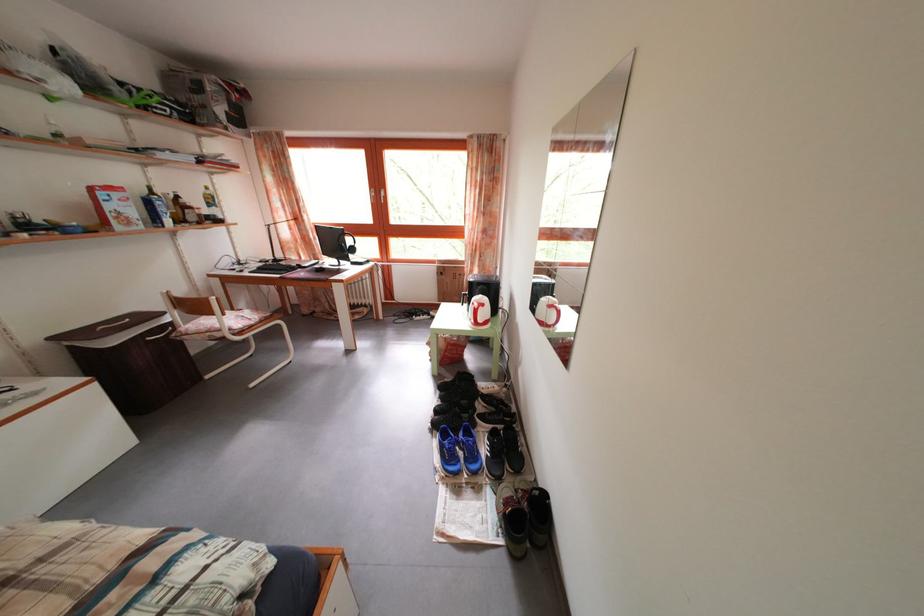
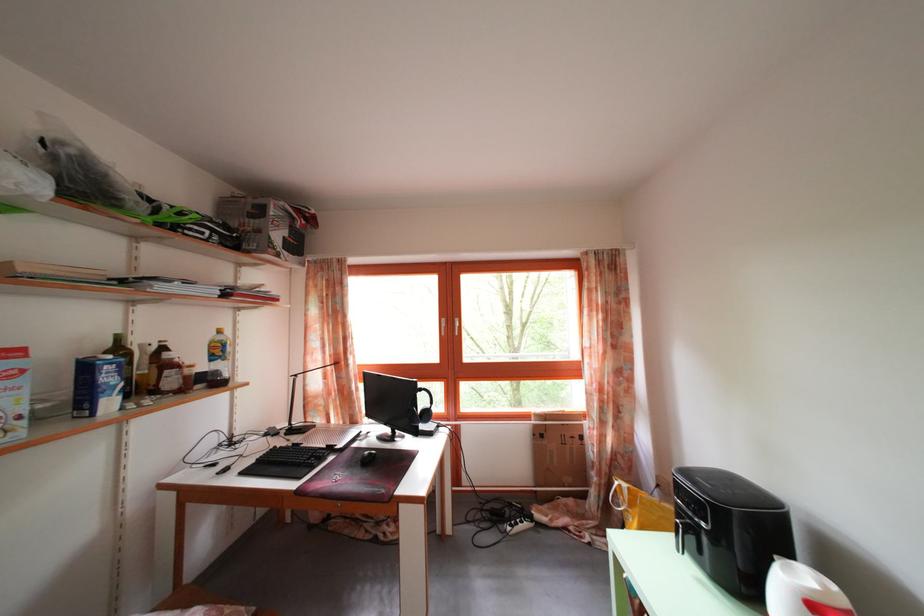
Locate, in the second image, the point that corresponds to the point at 445,275 in the first image.

(542, 432)